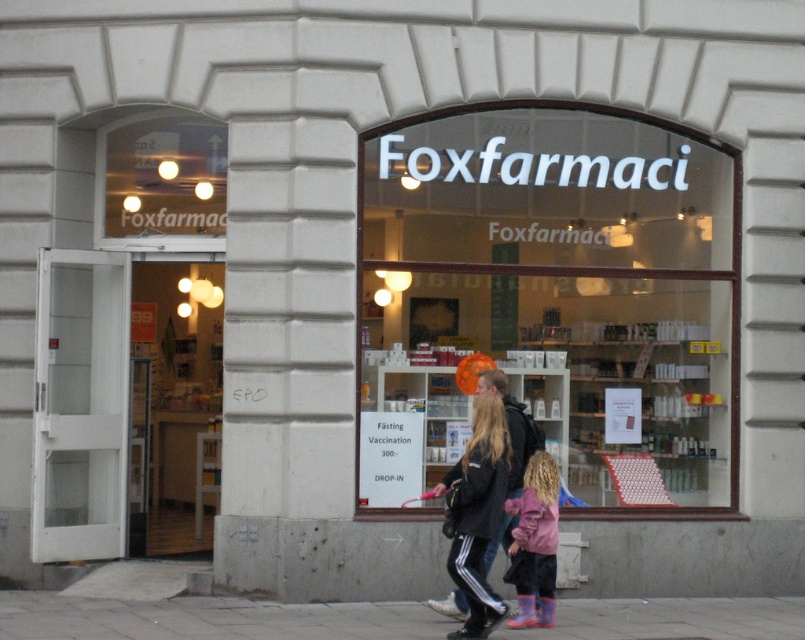
Question: Is pink fabric coat at center in front of pink matte jacket at lower center?

Choices:
 (A) yes
 (B) no

Answer: (A)

Question: Which point is farther to the camera?

Choices:
 (A) pink matte jacket at lower center
 (B) pink fabric coat at center
 (C) matte glass window at center
 (D) gray concrete pavement at lower center

Answer: (C)

Question: Is gray concrete pavement at lower center thinner than pink fabric coat at center?

Choices:
 (A) no
 (B) yes

Answer: (A)

Question: Estimate the real-world distances between objects in this image. Which object is closer to the pink fabric coat at center?

Choices:
 (A) gray concrete pavement at lower center
 (B) pink matte jacket at lower center
 (C) matte glass window at center

Answer: (B)

Question: Observing the image, what is the correct spatial positioning of matte glass window at center in reference to pink matte jacket at lower center?

Choices:
 (A) right
 (B) left

Answer: (A)

Question: Which point is farther to the camera?

Choices:
 (A) (345, 605)
 (B) (667, 433)

Answer: (B)